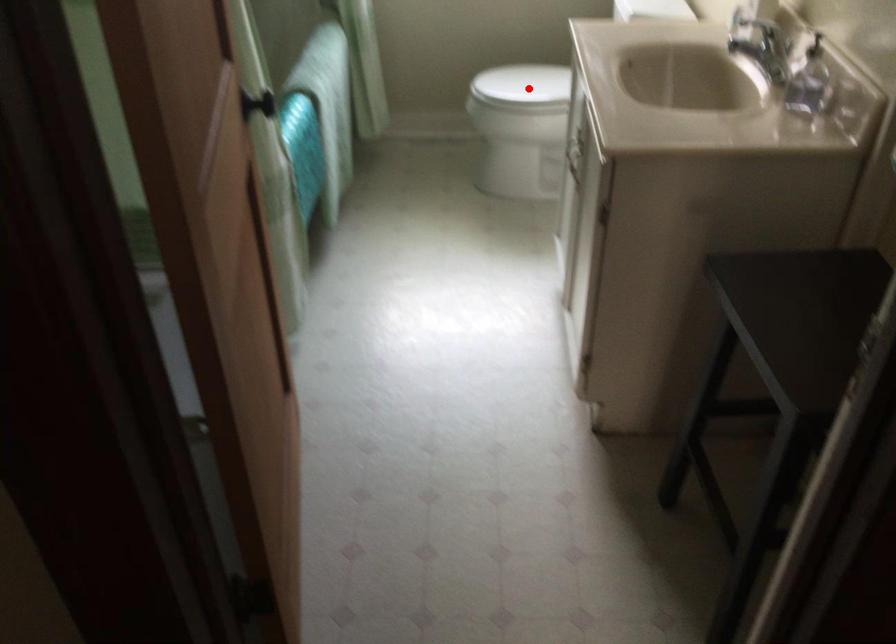
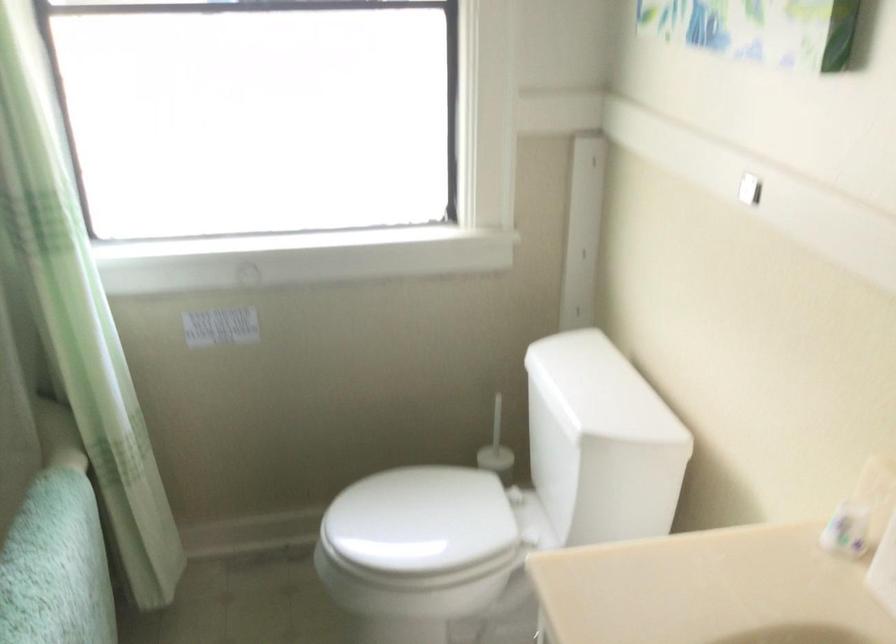
Locate, in the second image, the point that corresponds to the highlighted location in the first image.

(419, 526)